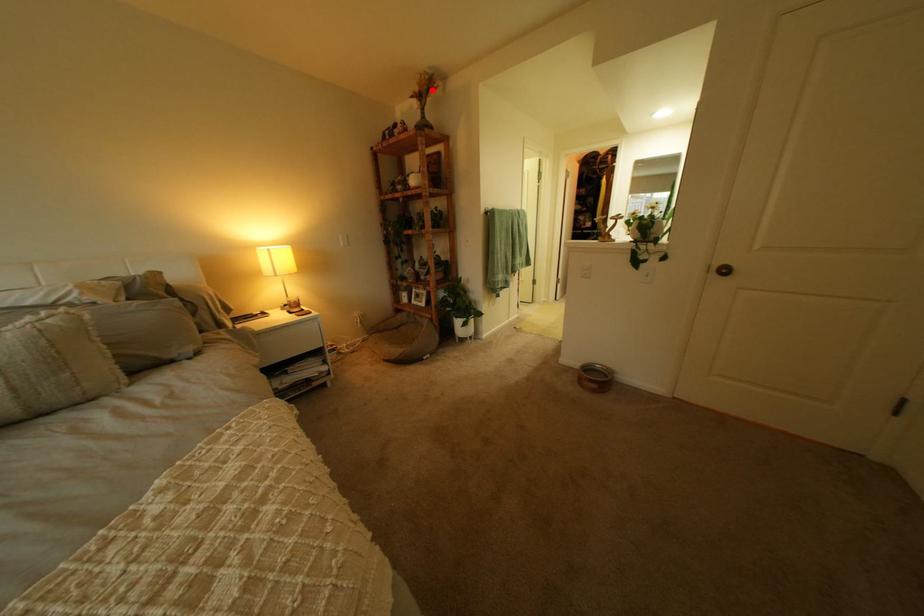
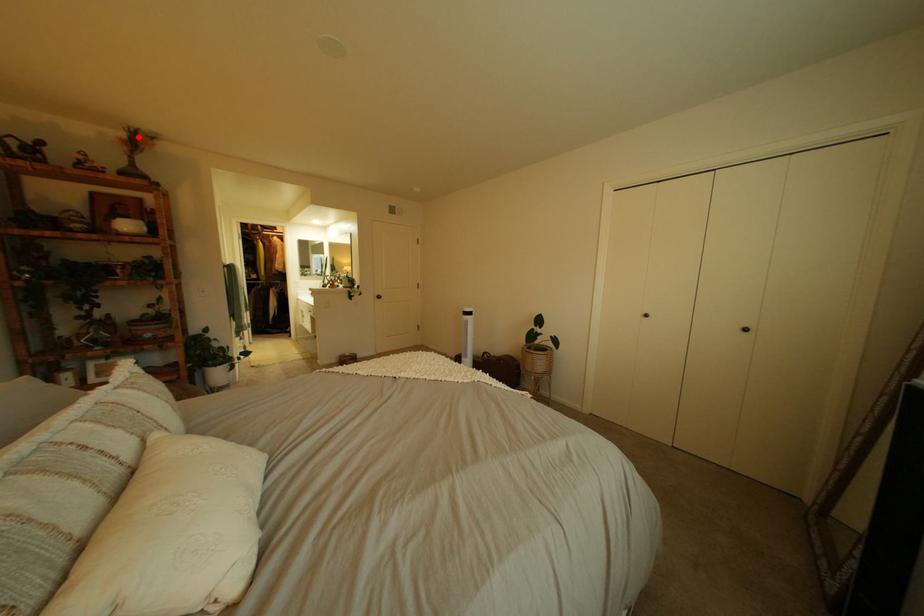
I am providing you with two images of the same scene from different viewpoints. A red point is marked on the first image and another point is marked on the second image. Is the red point in image1 aligned with the point shown in image2?

Yes